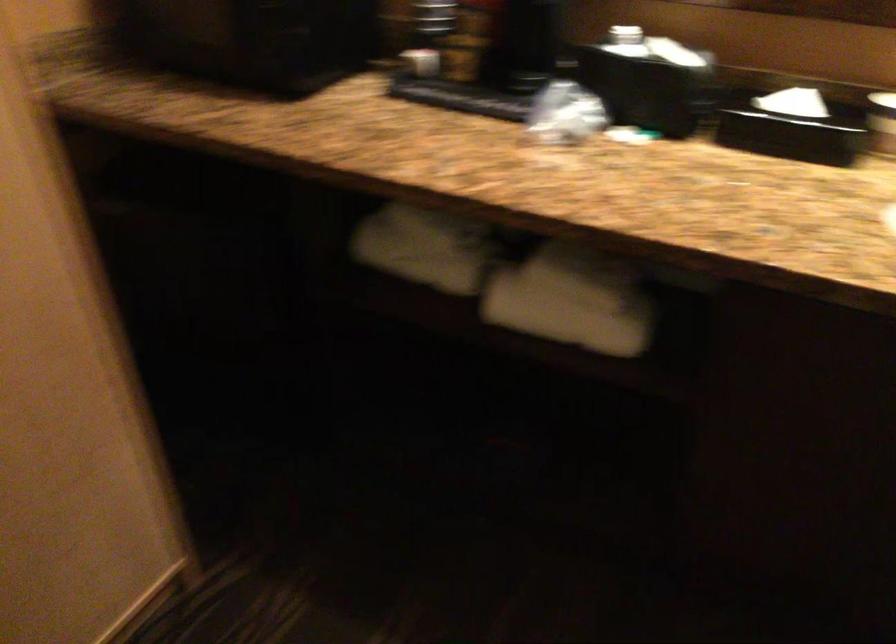
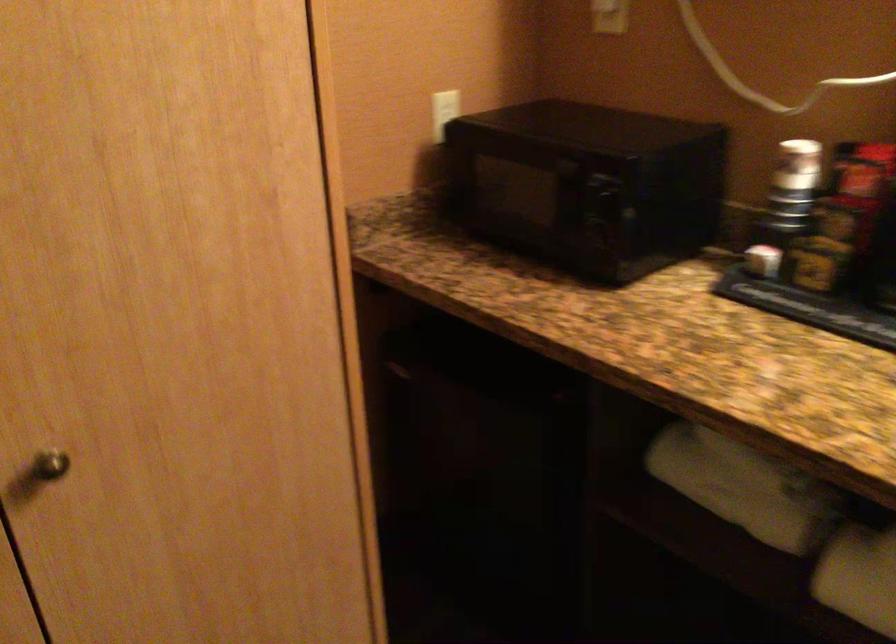
Where in the second image is the point corresponding to [448,267] from the first image?

(764, 509)